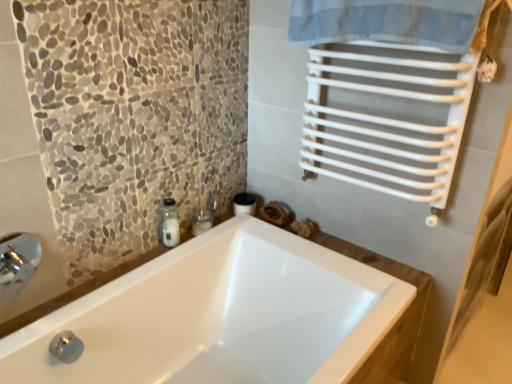
Question: Considering the relative sizes of white glossy bathtub at center and clear glass jar at upper left in the image provided, is white glossy bathtub at center bigger than clear glass jar at upper left?

Choices:
 (A) yes
 (B) no

Answer: (A)

Question: Is white glossy bathtub at center wider than clear glass jar at upper left?

Choices:
 (A) yes
 (B) no

Answer: (A)

Question: Considering the relative sizes of white glossy bathtub at center and clear glass jar at upper left in the image provided, is white glossy bathtub at center taller than clear glass jar at upper left?

Choices:
 (A) no
 (B) yes

Answer: (B)

Question: Can you confirm if white glossy bathtub at center is shorter than clear glass jar at upper left?

Choices:
 (A) no
 (B) yes

Answer: (A)

Question: From a real-world perspective, is white glossy bathtub at center positioned over clear glass jar at upper left based on gravity?

Choices:
 (A) yes
 (B) no

Answer: (B)

Question: Visually, is clear glass jar at upper left positioned to the left or to the right of white glossy bathtub at center?

Choices:
 (A) right
 (B) left

Answer: (B)

Question: Is clear glass jar at upper left spatially inside white glossy bathtub at center, or outside of it?

Choices:
 (A) inside
 (B) outside

Answer: (B)

Question: Considering the positions of clear glass jar at upper left and white glossy bathtub at center in the image, is clear glass jar at upper left bigger or smaller than white glossy bathtub at center?

Choices:
 (A) big
 (B) small

Answer: (B)

Question: Considering the positions of point (168, 205) and point (401, 297), is point (168, 205) closer or farther from the camera than point (401, 297)?

Choices:
 (A) closer
 (B) farther

Answer: (B)

Question: Is white glossy bathtub at center inside the boundaries of clear glass jar at upper left, or outside?

Choices:
 (A) outside
 (B) inside

Answer: (A)

Question: Is point (224, 345) positioned closer to the camera than point (165, 200)?

Choices:
 (A) farther
 (B) closer

Answer: (A)

Question: Is white glossy bathtub at center taller or shorter than clear glass jar at upper left?

Choices:
 (A) short
 (B) tall

Answer: (B)

Question: From the image's perspective, is white glossy bathtub at center positioned above or below clear glass jar at upper left?

Choices:
 (A) below
 (B) above

Answer: (A)

Question: From a real-world perspective, is clear glass jar at center positioned above or below white glossy bathtub at center?

Choices:
 (A) below
 (B) above

Answer: (B)

Question: Which is correct: clear glass jar at center is inside white glossy bathtub at center, or outside of it?

Choices:
 (A) outside
 (B) inside

Answer: (B)